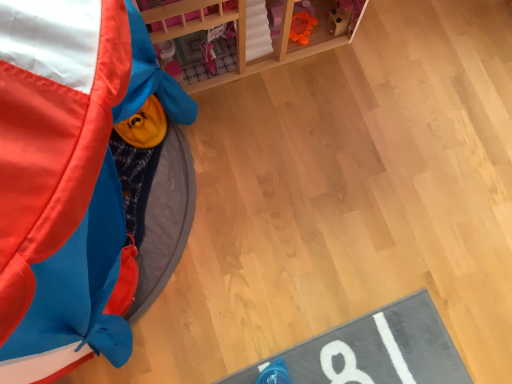
You are a GUI agent. You are given a task and a screenshot of the screen. Output one action in this format:
    pyautogui.click(x=<x>, y=<y>)
    Task: Click on the free space in front of wooden dollhouse at upper center
    The width and height of the screenshot is (512, 384).
    Given the screenshot: What is the action you would take?
    pyautogui.click(x=287, y=160)